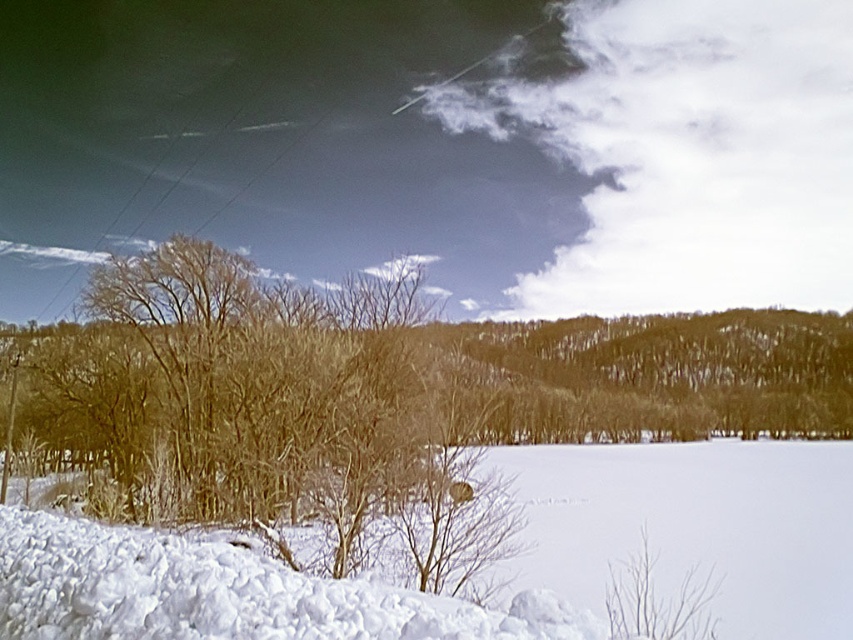
Does brown textured tree at left have a greater width compared to white fluffy snow at lower left?

No, brown textured tree at left is not wider than white fluffy snow at lower left.

Between point (410, 524) and point (792, 452), which one is positioned in front?

Point (410, 524) is in front.

The image size is (853, 640). I want to click on brown textured tree at left, so click(270, 417).